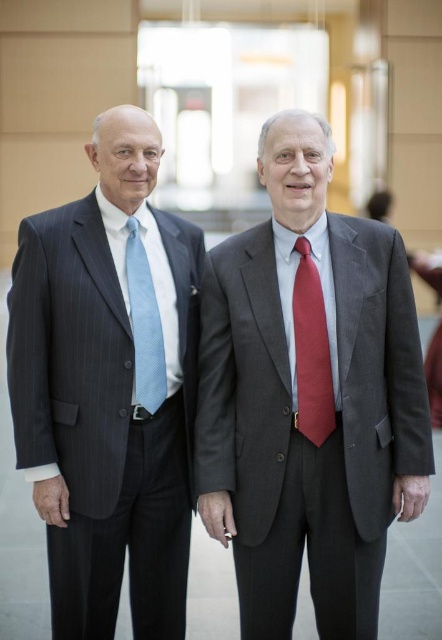
You are a photographer adjusting your camera settings to focus on the closest tie between the matte red tie at center and the light blue textured tie at left. Which tie should you focus on to ensure it appears sharp in the photo?

The matte red tie at center is closer to the viewer than the light blue textured tie at left, so you should focus on the matte red tie at center to ensure it appears sharp in the photo.

You are a fashion designer observing two men in the image. You need to determine which item is wider between the gray pinstripe suit at center and the matte red tie at center. Which one is wider?

The gray pinstripe suit at center is wider than the matte red tie at center according to the description.

You are a photographer setting up for a formal event. You need to position a spotlight on the pinstriped suit at left and another on the matte red tie at center. Based on their positions, which spotlight should be placed further to the left?

The spotlight for the pinstriped suit at left should be placed further to the left since the pinstriped suit at left is positioned to the left of the matte red tie at center.